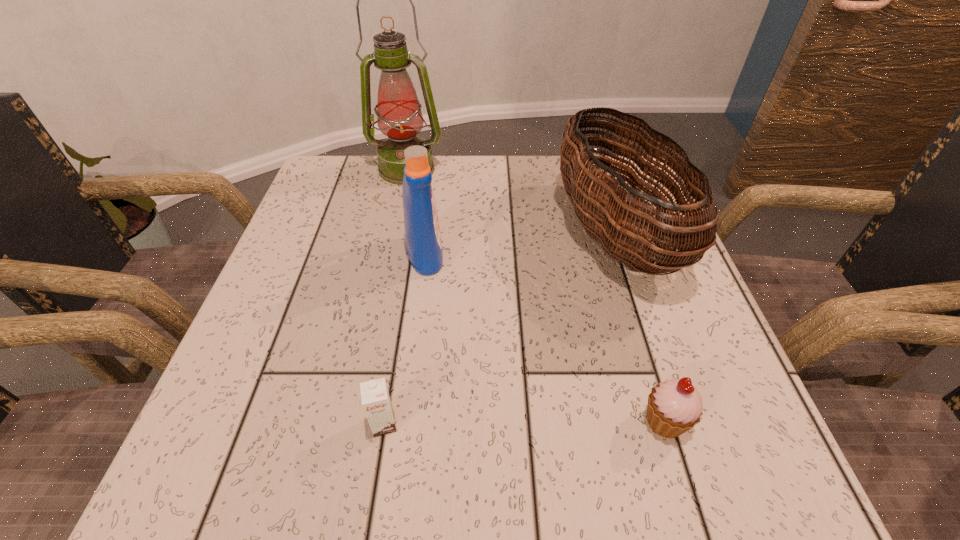
Where is `the tallest object`? The image size is (960, 540). the tallest object is located at coordinates tap(399, 117).

I want to click on the fourth shortest object, so click(x=422, y=232).

Where is `the third shortest object`? The height and width of the screenshot is (540, 960). the third shortest object is located at coordinates (616, 234).

I want to click on cupcake, so click(x=675, y=406).

You are a GUI agent. You are given a task and a screenshot of the screen. Output one action in this format:
    pyautogui.click(x=<x>, y=<y>)
    Task: Click on the chocolate milk
    This screenshot has height=540, width=960.
    Given the screenshot: What is the action you would take?
    pyautogui.click(x=376, y=402)

The height and width of the screenshot is (540, 960). Identify the location of vacant region located 0.240m on the right of the tallest object. (540, 169).

Find the location of a particular element. The height and width of the screenshot is (540, 960). vacant region located on the label of the fourth shortest object is located at coordinates (468, 253).

Identify the location of free space located on the left of the basket. (430, 233).

In order to click on free spot located 0.090m on the left of the cupcake in this screenshot , I will do `click(578, 421)`.

You are a GUI agent. You are given a task and a screenshot of the screen. Output one action in this format:
    pyautogui.click(x=<x>, y=<y>)
    Task: Click on the free space located 0.150m on the left of the chocolate milk
    This screenshot has height=540, width=960.
    Given the screenshot: What is the action you would take?
    pyautogui.click(x=267, y=424)